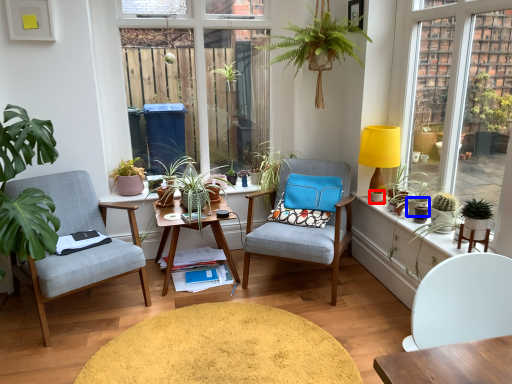
Question: Which object is closer to the camera taking this photo, flowerpot (highlighted by a red box) or flowerpot (highlighted by a blue box)?

Choices:
 (A) flowerpot
 (B) flowerpot

Answer: (B)